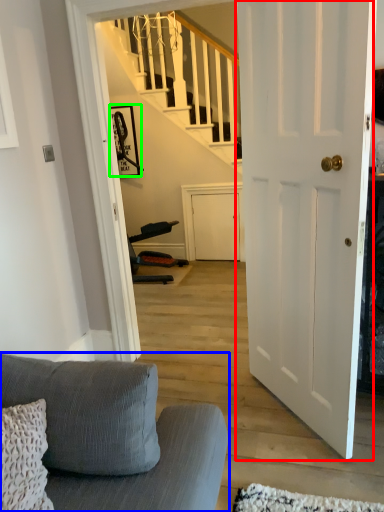
Question: Which object is positioned farthest from door (highlighted by a red box)? Select from studio couch (highlighted by a blue box) and picture frame (highlighted by a green box).

Choices:
 (A) studio couch
 (B) picture frame

Answer: (B)